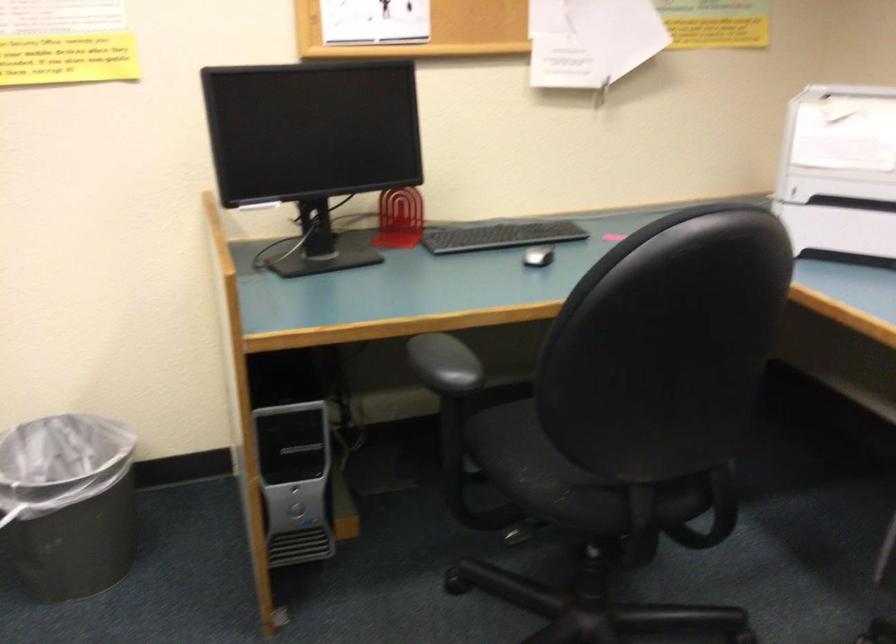
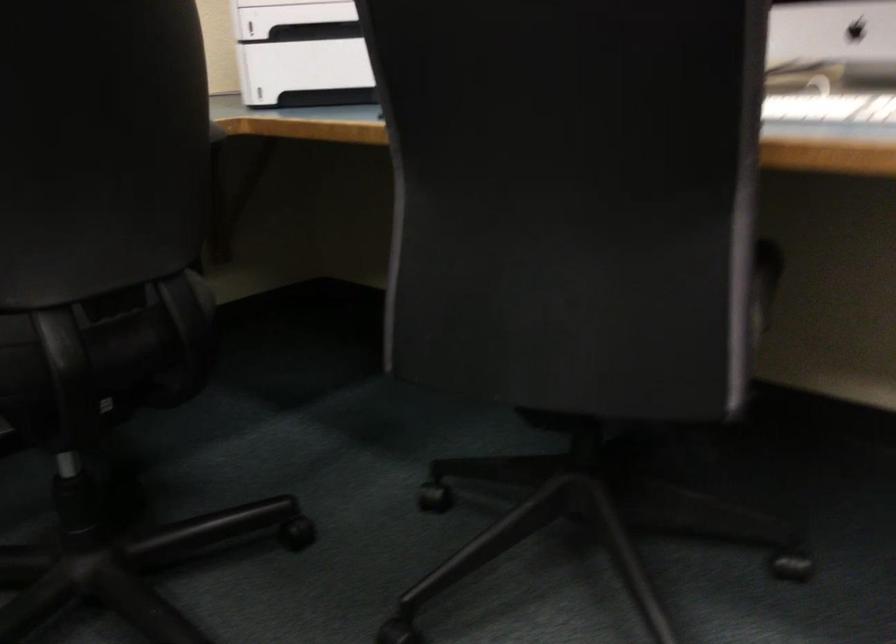
In the second image, find the point that corresponds to (x=822, y=218) in the first image.

(300, 69)